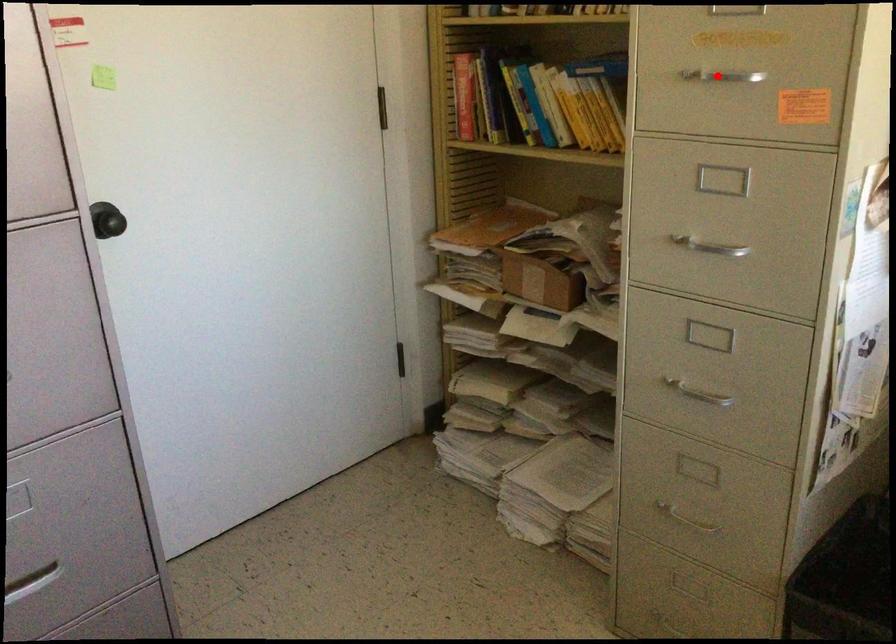
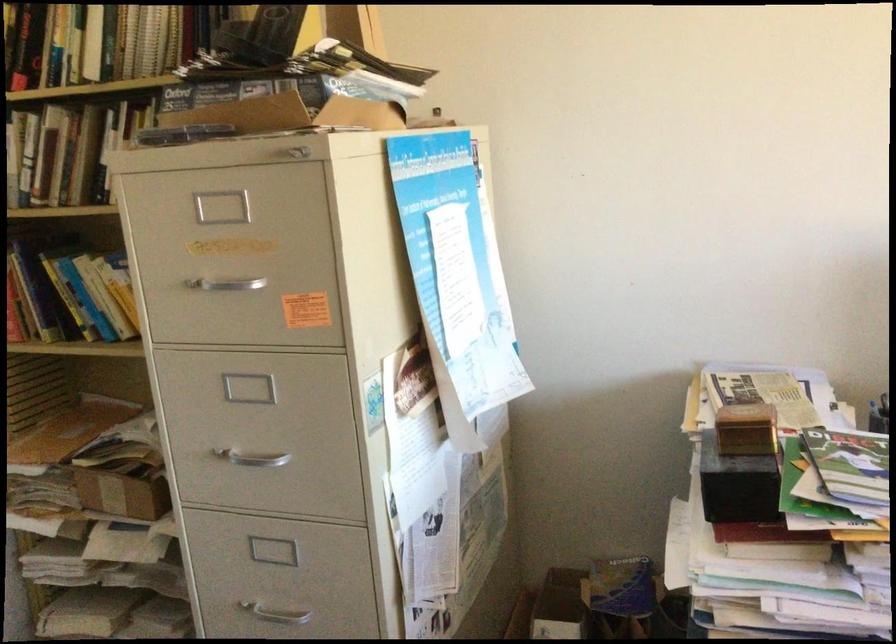
Where in the second image is the point corresponding to the highlighted location from the first image?

(224, 283)